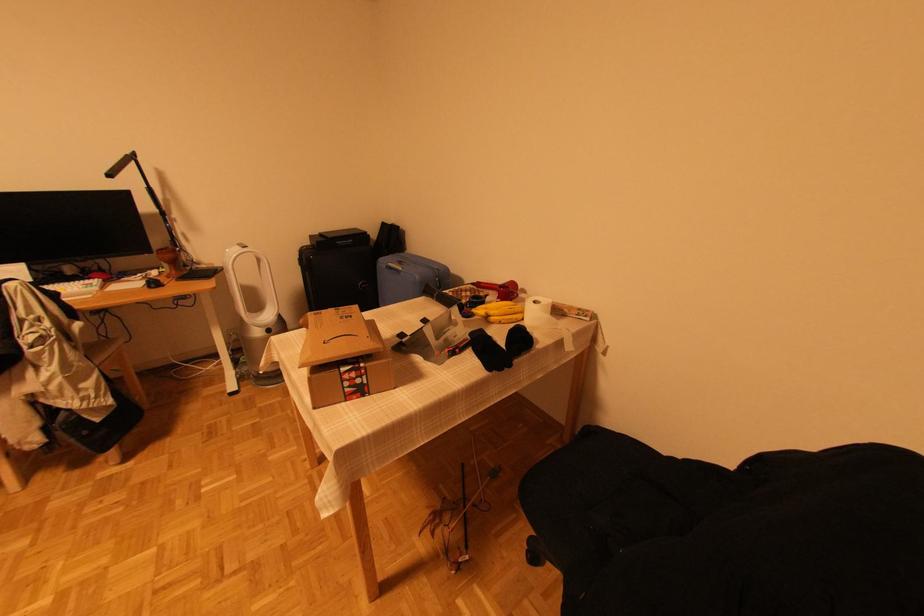
Identify the location of black computer mouse. (152, 283).